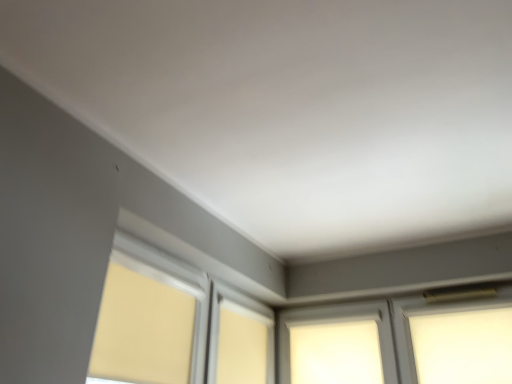
Measure the distance between white frosted glass at center, the 2th window in the right-to-left sequence, and camera.

They are 2.58 meters apart.

Describe the element at coordinates (335, 342) in the screenshot. This screenshot has width=512, height=384. I see `white frosted glass at center, acting as the first window starting from the left` at that location.

I want to click on white frosted glass at upper right, placed as the second window when sorted from left to right, so click(463, 346).

Where is `matte yellow roller shade at lower left`? The image size is (512, 384). matte yellow roller shade at lower left is located at coordinates (176, 324).

Which is behind, white frosted glass at center, the 2th window in the right-to-left sequence, or matte yellow roller shade at lower left?

white frosted glass at center, the 2th window in the right-to-left sequence.

From a real-world perspective, is white frosted glass at center, acting as the first window starting from the left, positioned above or below matte yellow roller shade at lower left?

Clearly, from a real-world perspective, white frosted glass at center, acting as the first window starting from the left, is above matte yellow roller shade at lower left.

Considering the relative sizes of white frosted glass at center, acting as the first window starting from the left, and matte yellow roller shade at lower left in the image provided, is white frosted glass at center, acting as the first window starting from the left, bigger than matte yellow roller shade at lower left?

Indeed, white frosted glass at center, acting as the first window starting from the left, has a larger size compared to matte yellow roller shade at lower left.

From the image's perspective, between white frosted glass at center, acting as the first window starting from the left, and matte yellow roller shade at lower left, who is located below?

white frosted glass at center, acting as the first window starting from the left, appears lower in the image.

Between matte yellow roller shade at lower left and white frosted glass at upper right, which appears as the 1th window when viewed from the right, which one has smaller size?

Smaller between the two is white frosted glass at upper right, which appears as the 1th window when viewed from the right.

Is the position of matte yellow roller shade at lower left less distant than that of white frosted glass at upper right, which appears as the 1th window when viewed from the right?

Yes, matte yellow roller shade at lower left is in front of white frosted glass at upper right, which appears as the 1th window when viewed from the right.

Can you tell me how much matte yellow roller shade at lower left and white frosted glass at upper right, which appears as the 1th window when viewed from the right, differ in facing direction?

The angular difference between matte yellow roller shade at lower left and white frosted glass at upper right, which appears as the 1th window when viewed from the right, is 90.7 degrees.

The image size is (512, 384). I want to click on bay window above the white frosted glass at upper right, placed as the second window when sorted from left to right (from the image's perspective), so click(176, 324).

Is white frosted glass at center, acting as the first window starting from the left, turned away from white frosted glass at upper right, placed as the second window when sorted from left to right?

That's not correct — white frosted glass at center, acting as the first window starting from the left, is not looking away from white frosted glass at upper right, placed as the second window when sorted from left to right.

Between white frosted glass at center, acting as the first window starting from the left, and white frosted glass at upper right, placed as the second window when sorted from left to right, which one has less height?

white frosted glass at upper right, placed as the second window when sorted from left to right, is shorter.

In the scene shown: Which is more to the right, white frosted glass at center, the 2th window in the right-to-left sequence, or white frosted glass at upper right, which appears as the 1th window when viewed from the right?

From the viewer's perspective, white frosted glass at upper right, which appears as the 1th window when viewed from the right, appears more on the right side.

Does white frosted glass at upper right, placed as the second window when sorted from left to right, touch white frosted glass at center, the 2th window in the right-to-left sequence?

No.

From the picture: Does white frosted glass at upper right, which appears as the 1th window when viewed from the right, have a smaller size compared to white frosted glass at center, acting as the first window starting from the left?

Yes.

Choose the correct answer: Is white frosted glass at upper right, which appears as the 1th window when viewed from the right, inside white frosted glass at center, acting as the first window starting from the left, or outside it?

white frosted glass at upper right, which appears as the 1th window when viewed from the right, is spatially situated outside white frosted glass at center, acting as the first window starting from the left.

Is point (467, 318) closer or farther from the camera than point (362, 347)?

Point (467, 318) appears to be closer to the viewer than point (362, 347).

Is matte yellow roller shade at lower left positioned in front of white frosted glass at center, acting as the first window starting from the left?

Yes, matte yellow roller shade at lower left is closer to the camera.

Does matte yellow roller shade at lower left have a smaller size compared to white frosted glass at center, acting as the first window starting from the left?

Indeed, matte yellow roller shade at lower left has a smaller size compared to white frosted glass at center, acting as the first window starting from the left.

Which object is positioned more to the left, matte yellow roller shade at lower left or white frosted glass at center, the 2th window in the right-to-left sequence?

Positioned to the left is matte yellow roller shade at lower left.

Is matte yellow roller shade at lower left located outside white frosted glass at center, acting as the first window starting from the left?

Indeed, matte yellow roller shade at lower left is completely outside white frosted glass at center, acting as the first window starting from the left.

Could you tell me if white frosted glass at upper right, placed as the second window when sorted from left to right, is facing matte yellow roller shade at lower left?

No, white frosted glass at upper right, placed as the second window when sorted from left to right, is not aimed at matte yellow roller shade at lower left.

Image resolution: width=512 pixels, height=384 pixels. Identify the location of the 1st window directly above the matte yellow roller shade at lower left (from a real-world perspective). (463, 346).

Would you say white frosted glass at upper right, which appears as the 1th window when viewed from the right, is to the left or to the right of matte yellow roller shade at lower left in the picture?

From the image, it's evident that white frosted glass at upper right, which appears as the 1th window when viewed from the right, is to the right of matte yellow roller shade at lower left.

You are a GUI agent. You are given a task and a screenshot of the screen. Output one action in this format:
    pyautogui.click(x=<x>, y=<y>)
    Task: Click on the bay window directly beneath the white frosted glass at center, acting as the first window starting from the left (from a real-world perspective)
    This screenshot has height=384, width=512.
    Given the screenshot: What is the action you would take?
    pyautogui.click(x=176, y=324)

Find the location of a particular element. The image size is (512, 384). the 2nd window to the right of the matte yellow roller shade at lower left, starting your count from the anchor is located at coordinates (463, 346).

Which object lies further to the anchor point matte yellow roller shade at lower left, white frosted glass at center, the 2th window in the right-to-left sequence, or white frosted glass at upper right, placed as the second window when sorted from left to right?

white frosted glass at upper right, placed as the second window when sorted from left to right, is further to matte yellow roller shade at lower left.

Based on the photo, which object lies nearer to the anchor point white frosted glass at center, the 2th window in the right-to-left sequence, matte yellow roller shade at lower left or white frosted glass at upper right, which appears as the 1th window when viewed from the right?

white frosted glass at upper right, which appears as the 1th window when viewed from the right, is closer to white frosted glass at center, the 2th window in the right-to-left sequence.

Based on their spatial positions, is white frosted glass at upper right, which appears as the 1th window when viewed from the right, or white frosted glass at center, the 2th window in the right-to-left sequence, further from matte yellow roller shade at lower left?

Among the two, white frosted glass at upper right, which appears as the 1th window when viewed from the right, is located further to matte yellow roller shade at lower left.

Which object lies nearer to the anchor point white frosted glass at center, acting as the first window starting from the left, white frosted glass at upper right, placed as the second window when sorted from left to right, or matte yellow roller shade at lower left?

Based on the image, white frosted glass at upper right, placed as the second window when sorted from left to right, appears to be nearer to white frosted glass at center, acting as the first window starting from the left.

Based on their spatial positions, is matte yellow roller shade at lower left or white frosted glass at center, the 2th window in the right-to-left sequence, closer to white frosted glass at upper right, placed as the second window when sorted from left to right?

white frosted glass at center, the 2th window in the right-to-left sequence, is closer to white frosted glass at upper right, placed as the second window when sorted from left to right.

Based on their spatial positions, is white frosted glass at center, the 2th window in the right-to-left sequence, or matte yellow roller shade at lower left closer to white frosted glass at upper right, which appears as the 1th window when viewed from the right?

white frosted glass at center, the 2th window in the right-to-left sequence, is closer to white frosted glass at upper right, which appears as the 1th window when viewed from the right.

At what (x,y) coordinates should I click in order to perform the action: click on window between matte yellow roller shade at lower left and white frosted glass at upper right, placed as the second window when sorted from left to right. Please return your answer as a coordinate pair (x, y). The width and height of the screenshot is (512, 384). Looking at the image, I should click on (335, 342).